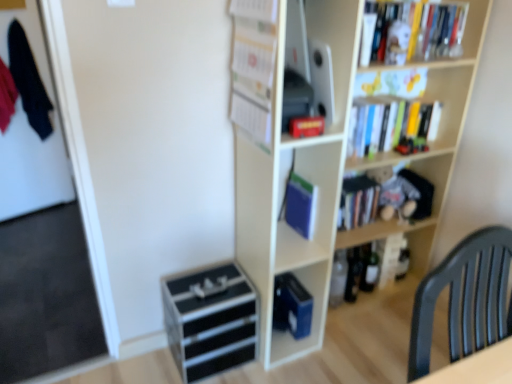
Where is `free spot in front of blue matte book at center, the 1th paperback book viewed from the back`? free spot in front of blue matte book at center, the 1th paperback book viewed from the back is located at coordinates pyautogui.click(x=300, y=362).